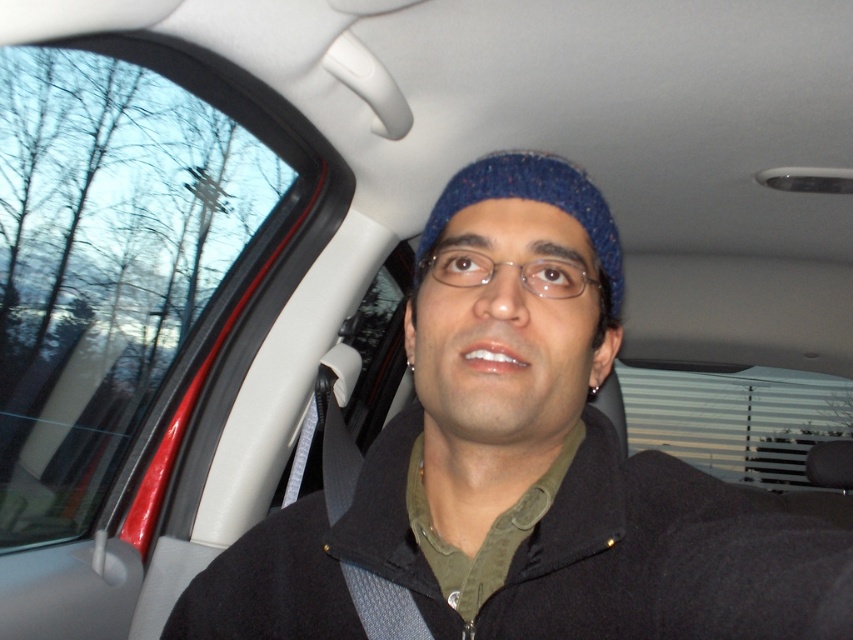
Question: Which point is closer to the camera taking this photo?

Choices:
 (A) (67, 186)
 (B) (438, 232)

Answer: (B)

Question: Among these points, which one is nearest to the camera?

Choices:
 (A) (86, 291)
 (B) (544, 193)

Answer: (B)

Question: Can you confirm if transparent glass window at upper left is thinner than blue knitted hat at center?

Choices:
 (A) yes
 (B) no

Answer: (B)

Question: Can you confirm if transparent glass window at upper left is positioned to the left of blue knitted hat at center?

Choices:
 (A) no
 (B) yes

Answer: (B)

Question: Is transparent glass window at upper left positioned at the back of blue knitted hat at center?

Choices:
 (A) no
 (B) yes

Answer: (B)

Question: Which of the following is the closest to the observer?

Choices:
 (A) (482, 168)
 (B) (115, 433)

Answer: (A)